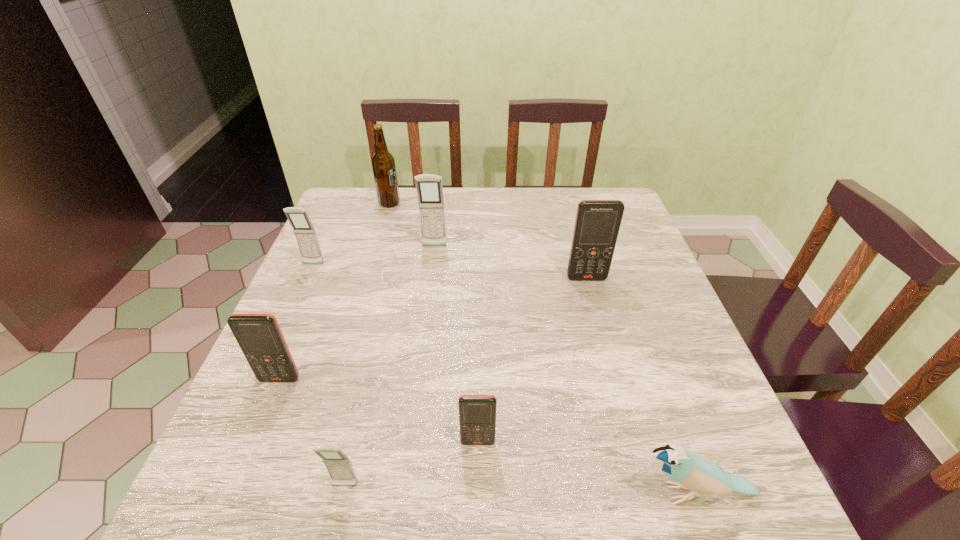
Where is `cellular telephone that is the fifth closest one to the beer bottle`? This screenshot has height=540, width=960. cellular telephone that is the fifth closest one to the beer bottle is located at coordinates (477, 413).

Find the location of a particular element. The height and width of the screenshot is (540, 960). gray cellular telephone identified as the closest to the fourth object from left to right is located at coordinates (304, 232).

Identify which gray cellular telephone is located as the third nearest to the beer bottle. Please provide its 2D coordinates. Your answer should be formatted as a tuple, i.e. [(x, y)], where the tuple contains the x and y coordinates of a point satisfying the conditions above.

[(338, 465)]

Find the location of a particular element. the closest orange cellular telephone to the fourth nearest object is located at coordinates coord(477,413).

Identify which orange cellular telephone is located as the second nearest to the second biggest orange cellular telephone. Please provide its 2D coordinates. Your answer should be formatted as a tuple, i.e. [(x, y)], where the tuple contains the x and y coordinates of a point satisfying the conditions above.

[(597, 223)]